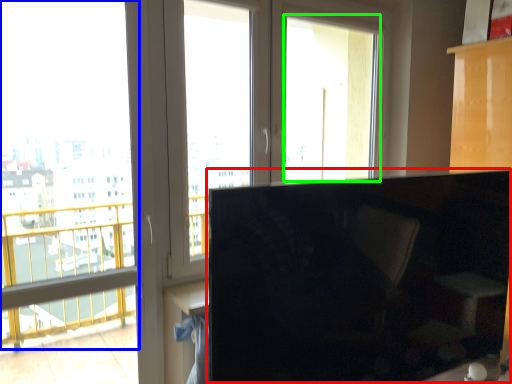
Question: Which object is positioned farthest from computer monitor (highlighted by a red box)? Select from window screen (highlighted by a blue box) and window screen (highlighted by a green box).

Choices:
 (A) window screen
 (B) window screen

Answer: (B)